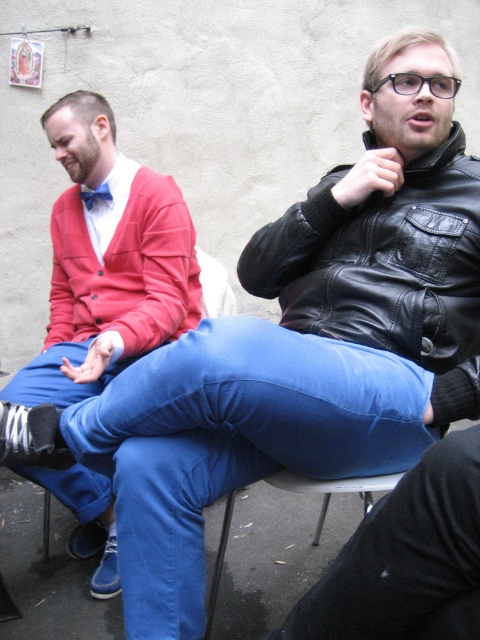
Question: Can you confirm if matte red sweater at left is wider than metallic blue chair at center?

Choices:
 (A) no
 (B) yes

Answer: (B)

Question: In this image, where is metallic blue chair at center located relative to blue satin bow tie at upper left?

Choices:
 (A) left
 (B) right

Answer: (B)

Question: Estimate the real-world distances between objects in this image. Which object is closer to the matte red sweater at left?

Choices:
 (A) black leather jacket at upper right
 (B) blue satin bow tie at upper left
 (C) metallic blue chair at center

Answer: (B)

Question: Which object is the closest to the blue satin bow tie at upper left?

Choices:
 (A) metallic blue chair at center
 (B) black leather jacket at upper right
 (C) matte red sweater at left

Answer: (C)

Question: Which of these objects is positioned farthest from the blue satin bow tie at upper left?

Choices:
 (A) matte red sweater at left
 (B) metallic blue chair at center
 (C) black leather jacket at upper right

Answer: (C)

Question: Does matte red sweater at left have a larger size compared to blue satin bow tie at upper left?

Choices:
 (A) no
 (B) yes

Answer: (B)